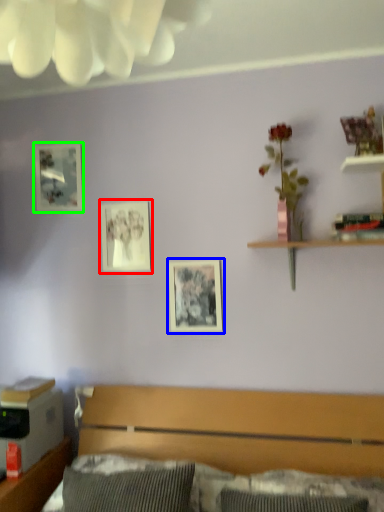
Question: Considering the real-world distances, which object is closest to picture frame (highlighted by a red box)? picture frame (highlighted by a blue box) or picture frame (highlighted by a green box).

Choices:
 (A) picture frame
 (B) picture frame

Answer: (A)